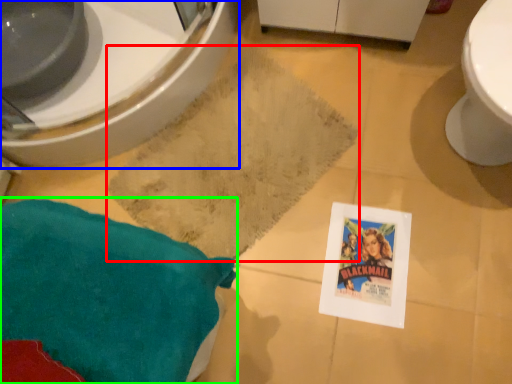
Question: Which is farther away from bath mat (highlighted by a red box)? bidet (highlighted by a blue box) or throw pillow (highlighted by a green box)?

Choices:
 (A) bidet
 (B) throw pillow

Answer: (B)